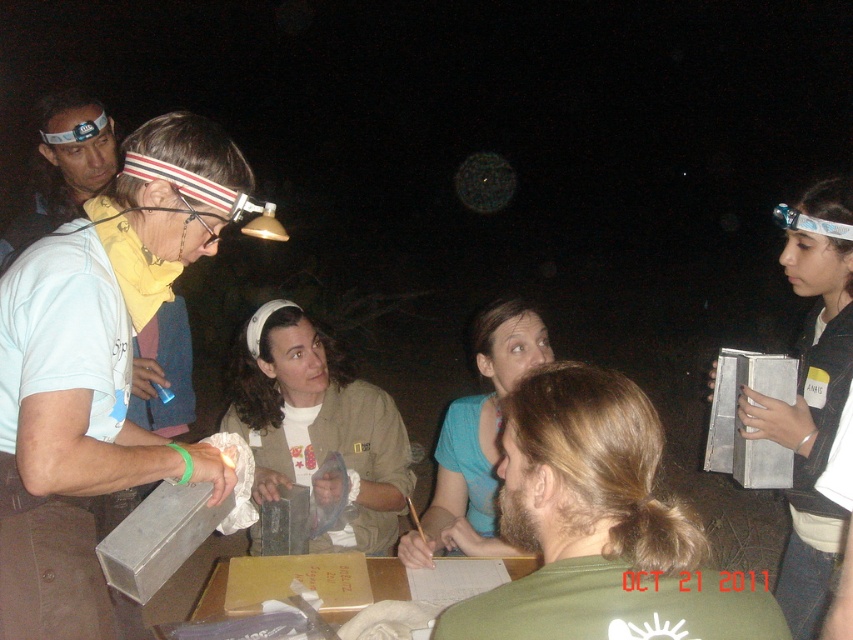
Question: Can you confirm if white paper book at right is smaller than matte black headlamp at upper left?

Choices:
 (A) no
 (B) yes

Answer: (A)

Question: Is khaki fabric jacket at center wider than white paper book at right?

Choices:
 (A) yes
 (B) no

Answer: (A)

Question: Is matte gray box at left further to camera compared to white paper book at right?

Choices:
 (A) no
 (B) yes

Answer: (A)

Question: Which point is closer to the camera taking this photo?

Choices:
 (A) (299, 308)
 (B) (84, 458)

Answer: (B)

Question: Considering the real-world distances, which object is closest to the matte gray box at left?

Choices:
 (A) matte white shirt at upper left
 (B) green matte shirt at center
 (C) matte black headlamp at upper left
 (D) blue matte shirt at center

Answer: (A)

Question: Among these objects, which one is nearest to the camera?

Choices:
 (A) matte gray box at left
 (B) white paper book at right
 (C) matte white shirt at upper left

Answer: (A)